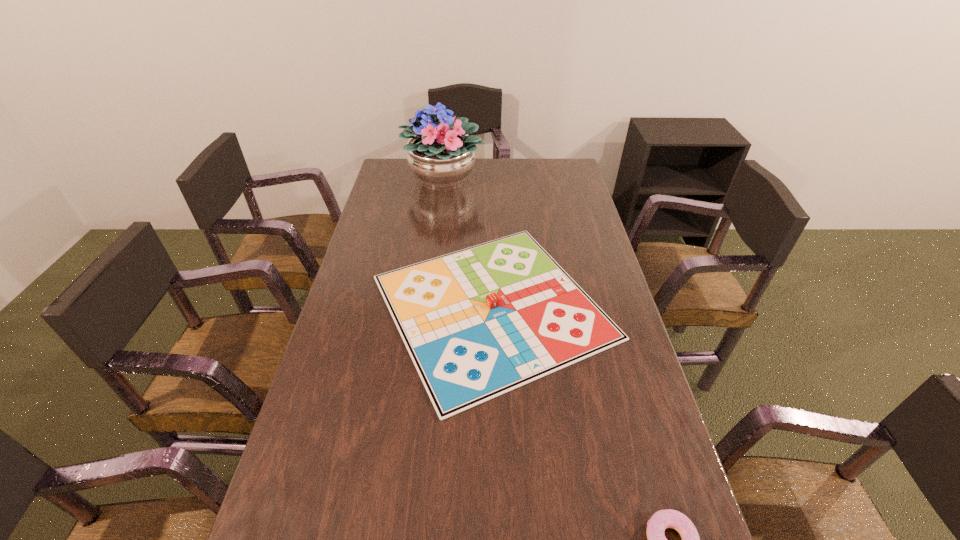
Identify the location of the tallest object. (441, 154).

At what (x,y) coordinates should I click in order to perform the action: click on the farthest object. Please return your answer as a coordinate pair (x, y). The width and height of the screenshot is (960, 540). Looking at the image, I should click on pos(441,154).

Where is `gameboard`? The image size is (960, 540). gameboard is located at coordinates (479, 322).

The image size is (960, 540). What are the coordinates of `free space located 0.070m on the front of the farthest object` in the screenshot? It's located at (439, 214).

Locate an element on the screen. The image size is (960, 540). free space located 0.180m on the front of the second farthest object is located at coordinates (498, 502).

The height and width of the screenshot is (540, 960). I want to click on object located in the far edge section of the desktop, so click(x=441, y=154).

Locate an element on the screen. The width and height of the screenshot is (960, 540). bouquet that is at the left edge is located at coordinates (441, 154).

Where is `gameboard present at the left edge`? This screenshot has height=540, width=960. gameboard present at the left edge is located at coordinates (x=479, y=322).

You are a GUI agent. You are given a task and a screenshot of the screen. Output one action in this format:
    pyautogui.click(x=<x>, y=<y>)
    Task: Click on the object that is positioned at the right edge
    The image size is (960, 540).
    Given the screenshot: What is the action you would take?
    pyautogui.click(x=479, y=322)

You are a GUI agent. You are given a task and a screenshot of the screen. Output one action in this format:
    pyautogui.click(x=<x>, y=<y>)
    Task: Click on the object located in the far left corner section of the desktop
    
    Given the screenshot: What is the action you would take?
    pyautogui.click(x=441, y=154)